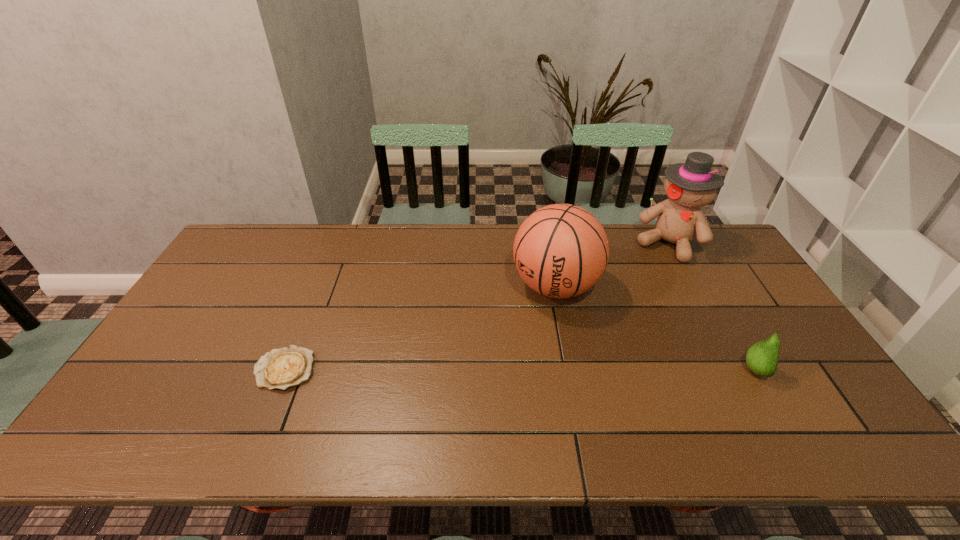
At what (x,y) coordinates should I click in order to perform the action: click on quiche. Please return your answer as a coordinate pair (x, y). Looking at the image, I should click on (282, 368).

Where is `the shortest object`? Image resolution: width=960 pixels, height=540 pixels. the shortest object is located at coordinates click(282, 368).

This screenshot has width=960, height=540. I want to click on avocado, so click(x=762, y=358).

Where is `basketball`? The height and width of the screenshot is (540, 960). basketball is located at coordinates (561, 250).

This screenshot has width=960, height=540. Identify the location of rag_doll. (690, 185).

Image resolution: width=960 pixels, height=540 pixels. Find the location of `vacant space located 0.160m on the left of the leftmost object`. vacant space located 0.160m on the left of the leftmost object is located at coordinates (192, 369).

In order to click on vacant area situated 0.130m on the cut side of the avocado in this screenshot , I will do `click(814, 371)`.

I want to click on free space located on the surface of the third object from right to left near the brand logo, so click(517, 340).

Image resolution: width=960 pixels, height=540 pixels. What are the coordinates of `vacant space situated 0.280m on the surface of the third object from right to left near the brand logo` in the screenshot? It's located at (489, 381).

Identify the location of vacant space located 0.130m on the surface of the third object from right to left near the brand logo. The width and height of the screenshot is (960, 540). (516, 342).